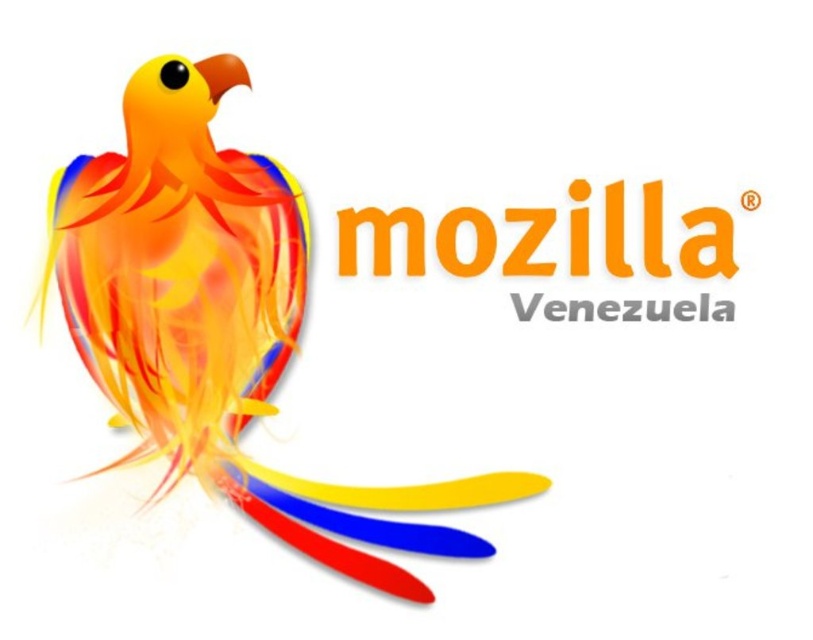
Question: Which of the following is the closest to the observer?

Choices:
 (A) (209, 259)
 (B) (706, 307)

Answer: (B)

Question: Does orange matte logo at center lie behind gray matte venezuela at center?

Choices:
 (A) yes
 (B) no

Answer: (B)

Question: Is orange matte logo at center further to the viewer compared to gray matte venezuela at center?

Choices:
 (A) no
 (B) yes

Answer: (A)

Question: Which point is farther from the camera taking this photo?

Choices:
 (A) (654, 262)
 (B) (725, 312)

Answer: (A)

Question: Is orange matte logo at center smaller than gray matte venezuela at center?

Choices:
 (A) yes
 (B) no

Answer: (B)

Question: Which object appears closest to the camera in this image?

Choices:
 (A) gray matte venezuela at center
 (B) orange matte logo at center
 (C) shiny multicolored parrot at left

Answer: (C)